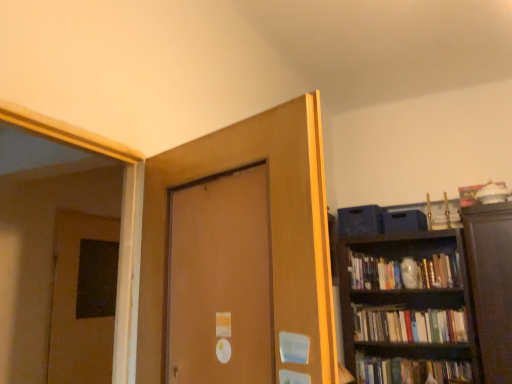
The height and width of the screenshot is (384, 512). Find the location of `matte brown door at center, placed as the 2th door when sorted from left to right`. matte brown door at center, placed as the 2th door when sorted from left to right is located at coordinates (270, 230).

This screenshot has width=512, height=384. What do you see at coordinates (409, 325) in the screenshot?
I see `hardcover books at right` at bounding box center [409, 325].

I want to click on matte brown door at center, which appears as the 1th door when viewed from the right, so click(x=270, y=230).

Is matte brown door at center, the first door when ordered from front to back, with hardcover books at right?

matte brown door at center, the first door when ordered from front to back, and hardcover books at right are not in contact.

Is matte brown door at center, placed as the 2th door when sorted from left to right, taller or shorter than hardcover books at right?

matte brown door at center, placed as the 2th door when sorted from left to right, is taller than hardcover books at right.

Can you confirm if matte brown door at center, the first door when ordered from front to back, is thinner than brown matte door at left, which ranks as the 1th door in back-to-front order?

Incorrect, the width of matte brown door at center, the first door when ordered from front to back, is not less than that of brown matte door at left, which ranks as the 1th door in back-to-front order.

Does matte brown door at center, the first door when ordered from front to back, turn towards brown matte door at left, which ranks as the 1th door in back-to-front order?

No, matte brown door at center, the first door when ordered from front to back, is not aimed at brown matte door at left, which ranks as the 1th door in back-to-front order.

From the image's perspective, between matte brown door at center, the first door when ordered from front to back, and brown matte door at left, which ranks as the 1th door in back-to-front order, who is located below?

brown matte door at left, which ranks as the 1th door in back-to-front order, from the image's perspective.

Considering the positions of points (152, 306) and (70, 240), is point (152, 306) farther from camera compared to point (70, 240)?

That is False.

Locate an element on the screen. The width and height of the screenshot is (512, 384). book on the right side of brown matte door at left, placed as the second door when sorted from front to back is located at coordinates (409, 325).

Looking at this image, how many degrees apart are the facing directions of brown matte door at left, placed as the second door when sorted from front to back, and hardcover books at right?

brown matte door at left, placed as the second door when sorted from front to back, and hardcover books at right are facing 92.8 degrees away from each other.

In terms of size, does brown matte door at left, placed as the 1th door when sorted from left to right, appear bigger or smaller than hardcover books at right?

In the image, brown matte door at left, placed as the 1th door when sorted from left to right, appears to be larger than hardcover books at right.

Between point (94, 334) and point (437, 316), which one is positioned in front?

The point (94, 334) is closer.

Between brown matte door at left, positioned as the second door in right-to-left order, and matte brown door at center, the first door when ordered from front to back, which one has larger size?

matte brown door at center, the first door when ordered from front to back.

Considering the relative sizes of brown matte door at left, which ranks as the 1th door in back-to-front order, and matte brown door at center, the first door when ordered from front to back, in the image provided, is brown matte door at left, which ranks as the 1th door in back-to-front order, wider than matte brown door at center, the first door when ordered from front to back,?

Incorrect, the width of brown matte door at left, which ranks as the 1th door in back-to-front order, does not surpass that of matte brown door at center, the first door when ordered from front to back.

Considering the relative sizes of brown matte door at left, positioned as the second door in right-to-left order, and matte brown door at center, the first door when ordered from front to back, in the image provided, is brown matte door at left, positioned as the second door in right-to-left order, taller than matte brown door at center, the first door when ordered from front to back,?

Yes.

From the image's perspective, is brown matte door at left, positioned as the second door in right-to-left order, below matte brown door at center, placed as the 2th door when sorted from left to right?

Indeed, from the image's perspective, brown matte door at left, positioned as the second door in right-to-left order, is shown beneath matte brown door at center, placed as the 2th door when sorted from left to right.

How different are the orientations of hardcover books at right and matte brown door at center, placed as the 2th door when sorted from left to right, in degrees?

The facing directions of hardcover books at right and matte brown door at center, placed as the 2th door when sorted from left to right, are 12.2 degrees apart.

How far apart are hardcover books at right and matte brown door at center, arranged as the second door when viewed from the back?

hardcover books at right is 2.36 meters from matte brown door at center, arranged as the second door when viewed from the back.

From the image's perspective, is hardcover books at right above or below matte brown door at center, arranged as the second door when viewed from the back?

hardcover books at right is below matte brown door at center, arranged as the second door when viewed from the back.

Which object is more forward, hardcover books at right or matte brown door at center, the first door when ordered from front to back?

matte brown door at center, the first door when ordered from front to back.

Considering the positions of objects hardcover books at right and brown matte door at left, which ranks as the 1th door in back-to-front order, in the image provided, who is more to the right, hardcover books at right or brown matte door at left, which ranks as the 1th door in back-to-front order,?

From the viewer's perspective, hardcover books at right appears more on the right side.

Considering the points (357, 338) and (79, 320), which point is behind, point (357, 338) or point (79, 320)?

The point (357, 338) is behind.

Which object is closer to the camera taking this photo, hardcover books at right or brown matte door at left, placed as the second door when sorted from front to back?

brown matte door at left, placed as the second door when sorted from front to back, is closer to the camera.

Is hardcover books at right turned away from brown matte door at left, which ranks as the 1th door in back-to-front order?

That's not correct — hardcover books at right is not looking away from brown matte door at left, which ranks as the 1th door in back-to-front order.

Locate an element on the screen. The height and width of the screenshot is (384, 512). door that is the 2nd one when counting forward from the hardcover books at right is located at coordinates (270, 230).

The width and height of the screenshot is (512, 384). I want to click on door on the left of matte brown door at center, which appears as the 1th door when viewed from the right, so click(x=74, y=305).

Estimate the real-world distances between objects in this image. Which object is closer to hardcover books at right, brown matte door at left, placed as the 1th door when sorted from left to right, or matte brown door at center, placed as the 2th door when sorted from left to right?

brown matte door at left, placed as the 1th door when sorted from left to right, is positioned closer to the anchor hardcover books at right.

Considering their positions, is matte brown door at center, arranged as the second door when viewed from the back, positioned further to hardcover books at right than brown matte door at left, which ranks as the 1th door in back-to-front order?

matte brown door at center, arranged as the second door when viewed from the back, is further to hardcover books at right.

Considering their positions, is matte brown door at center, arranged as the second door when viewed from the back, positioned further to brown matte door at left, positioned as the second door in right-to-left order, than hardcover books at right?

hardcover books at right.

Looking at the image, which one is located closer to brown matte door at left, placed as the second door when sorted from front to back, hardcover books at right or matte brown door at center, which appears as the 1th door when viewed from the right?

The object closer to brown matte door at left, placed as the second door when sorted from front to back, is matte brown door at center, which appears as the 1th door when viewed from the right.

From the image, which object appears to be nearer to matte brown door at center, placed as the 2th door when sorted from left to right, hardcover books at right or brown matte door at left, which ranks as the 1th door in back-to-front order?

brown matte door at left, which ranks as the 1th door in back-to-front order.

Which object lies nearer to the anchor point matte brown door at center, which appears as the 1th door when viewed from the right, brown matte door at left, positioned as the second door in right-to-left order, or hardcover books at right?

brown matte door at left, positioned as the second door in right-to-left order, is closer to matte brown door at center, which appears as the 1th door when viewed from the right.

This screenshot has height=384, width=512. Identify the location of door between brown matte door at left, which ranks as the 1th door in back-to-front order, and hardcover books at right, in the horizontal direction. 270,230.